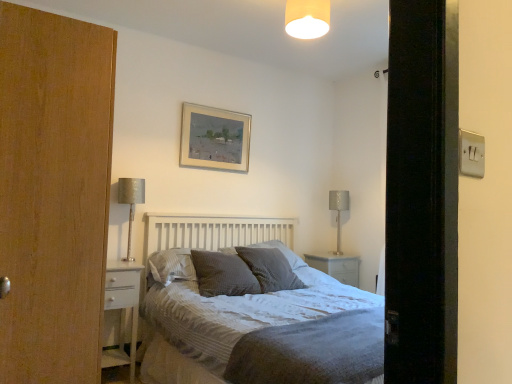
Question: From their relative heights in the image, would you say dark grey textured pillow at center, arranged as the 1th pillow when viewed from the left, is taller or shorter than textured gray pillow at center, arranged as the 4th pillow when viewed from the left?

Choices:
 (A) short
 (B) tall

Answer: (A)

Question: Is point (190, 264) positioned closer to the camera than point (260, 274)?

Choices:
 (A) farther
 (B) closer

Answer: (B)

Question: Based on their relative distances, which object is farther from the textured gray pillow at center, arranged as the 4th pillow when viewed from the left?

Choices:
 (A) satin silver table lamp at right, marked as the 1th table lamp in a back-to-front arrangement
 (B) textured grey pillow at center, which is the second pillow from right to left
 (C) dark grey textured pillow at center, arranged as the 1th pillow when viewed from the left
 (D) gold metallic picture frame at upper center
 (E) white glossy nightstand at lower left

Answer: (A)

Question: Which object is the farthest from the gold metallic picture frame at upper center?

Choices:
 (A) textured gray pillow at center, arranged as the 4th pillow when viewed from the left
 (B) white wood bed at center
 (C) matte beige lampshade at upper center
 (D) textured grey pillow at center, marked as the 3th pillow in a right-to-left arrangement
 (E) satin silver table lamp at right, acting as the first table lamp starting from the right

Answer: (E)